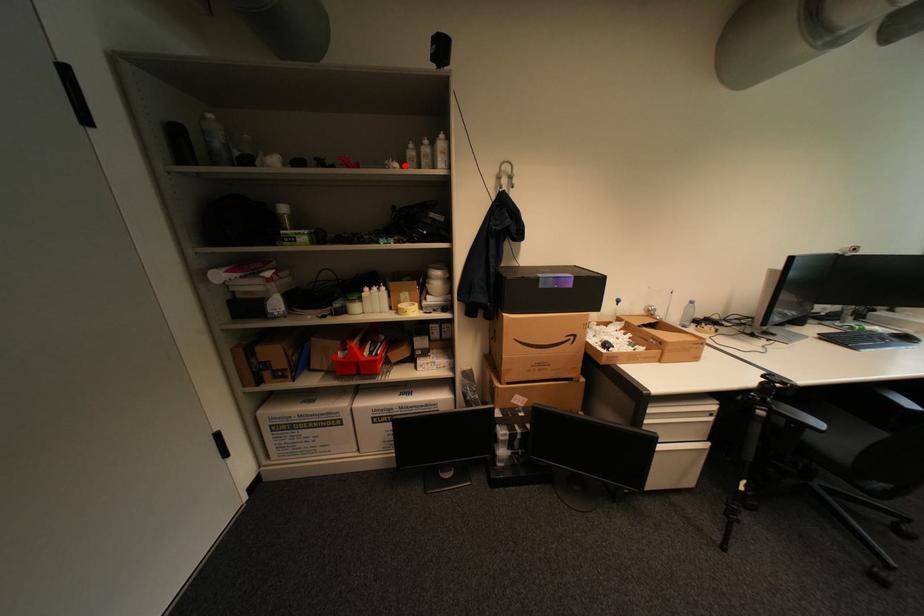
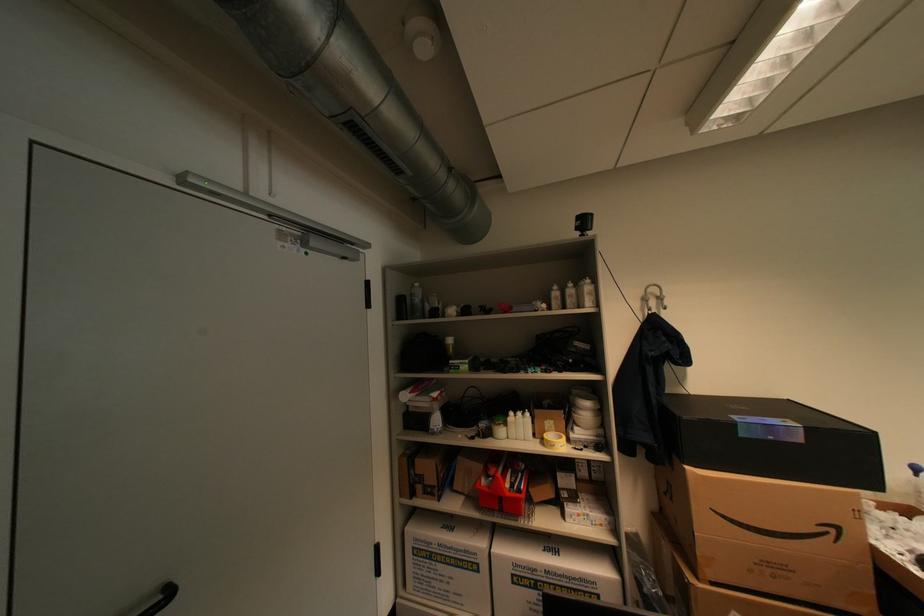
Question: I am providing you with two images of the same scene from different viewpoints. In image1, a red point is highlighted. Considering the same 3D point in image2, which of the following is correct?

Choices:
 (A) It is closer
 (B) It is farther

Answer: (B)